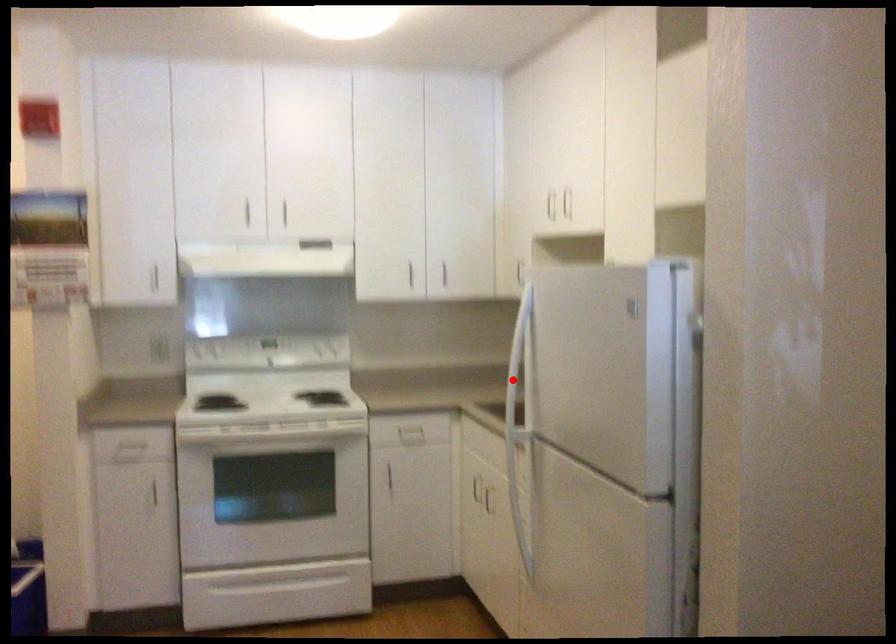
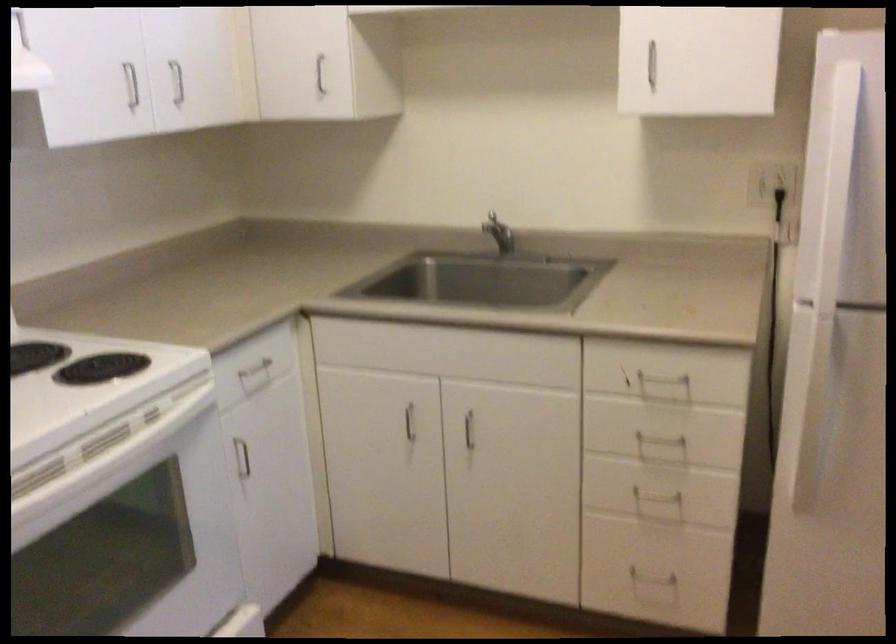
The point at the highlighted location is marked in the first image. Where is the corresponding point in the second image?

(831, 240)